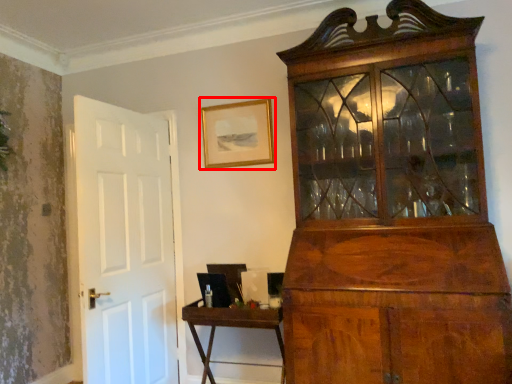
Question: From the image's perspective, considering the relative positions of picture frame (annotated by the red box) and table in the image provided, where is picture frame (annotated by the red box) located with respect to the staircase?

Choices:
 (A) above
 (B) below

Answer: (A)